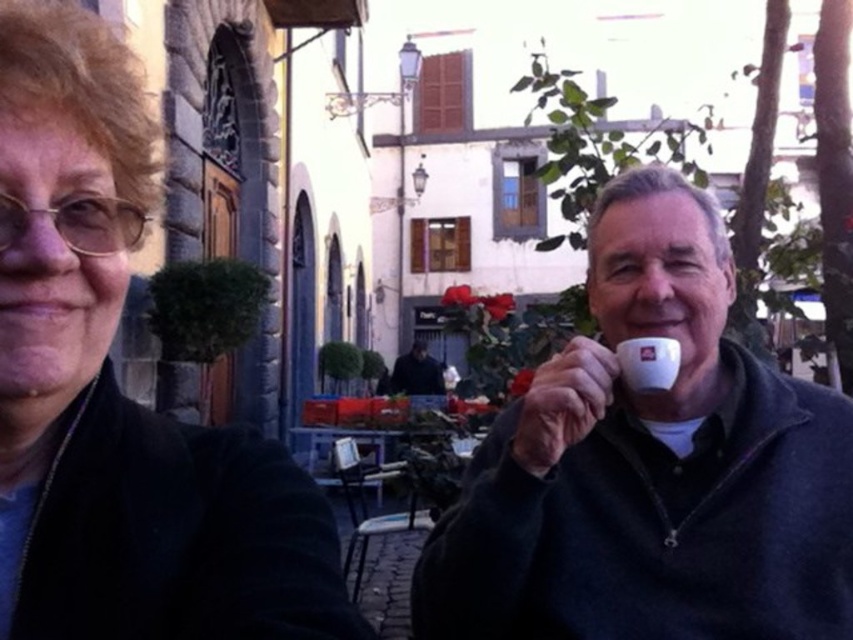
Does white ceramic cup at right have a lesser height compared to white matte mug at upper right?

No, white ceramic cup at right is not shorter than white matte mug at upper right.

Which is more to the left, white ceramic cup at right or white matte mug at upper right?

white matte mug at upper right

Where is `white ceramic cup at right`? white ceramic cup at right is located at coordinates (651, 467).

Identify the location of white ceramic cup at right. The width and height of the screenshot is (853, 640). (651, 467).

Does matte black jacket at left appear on the left side of dark blue sweater at center?

No, matte black jacket at left is not to the left of dark blue sweater at center.

Can you confirm if matte black jacket at left is smaller than dark blue sweater at center?

Correct, matte black jacket at left occupies less space than dark blue sweater at center.

You are a GUI agent. You are given a task and a screenshot of the screen. Output one action in this format:
    pyautogui.click(x=<x>, y=<y>)
    Task: Click on the matte black jacket at left
    
    Given the screenshot: What is the action you would take?
    pyautogui.click(x=119, y=390)

Locate an element on the screen. matte black jacket at left is located at coordinates (119, 390).

Consider the image. Can you confirm if white ceramic cup at right is positioned above matte black jacket at left?

No.

Is point (703, 246) positioned before point (105, 35)?

No, it is not.

At what (x,y) coordinates should I click in order to perform the action: click on white ceramic cup at right. Please return your answer as a coordinate pair (x, y). Looking at the image, I should click on (651, 467).